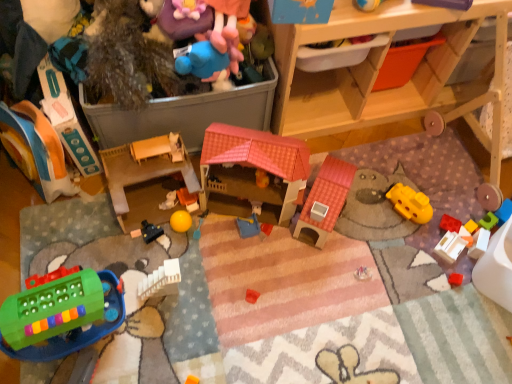
Find the location of a particular element. Image resolution: width=512 pixels, height=384 pixels. vacant area that lies between translucent plastic cube at center, the first toy when ordered from right to left, and yellow rubber ball at center, the 6th toy from the left is located at coordinates (334, 232).